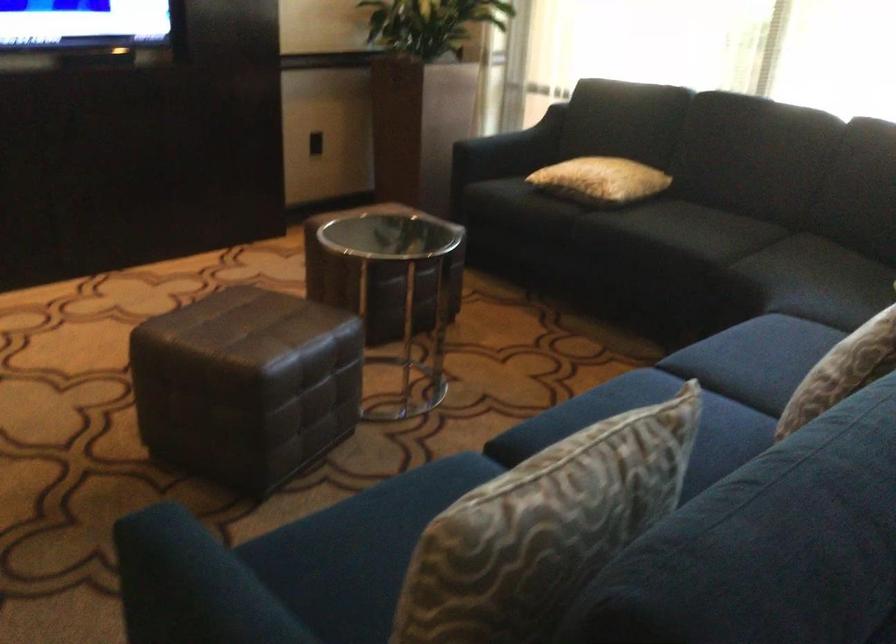
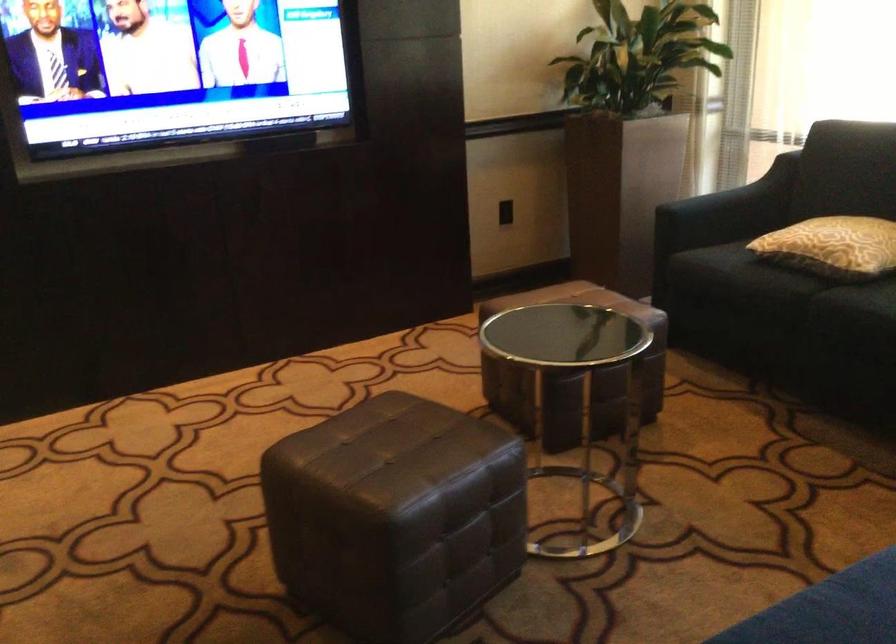
In the second image, find the point that corresponds to point 591,181 in the first image.

(832, 245)